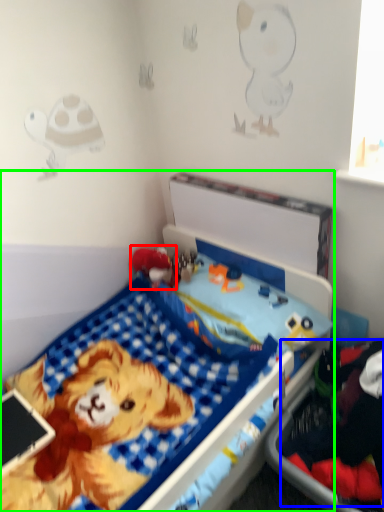
Question: Which object is positioned closest to toy (highlighted by a red box)? Select from clothing (highlighted by a blue box) and bed (highlighted by a green box).

Choices:
 (A) clothing
 (B) bed

Answer: (B)